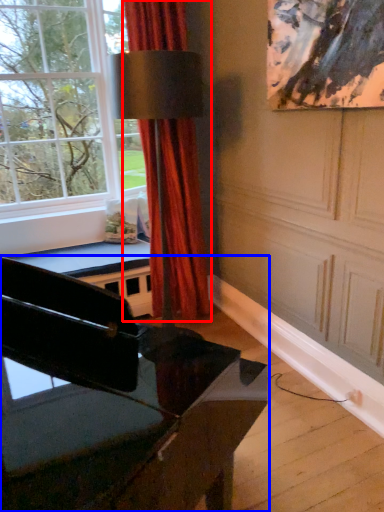
Question: Which of the following is the closest to the observer, curtain (highlighted by a red box) or piano (highlighted by a blue box)?

Choices:
 (A) curtain
 (B) piano

Answer: (B)